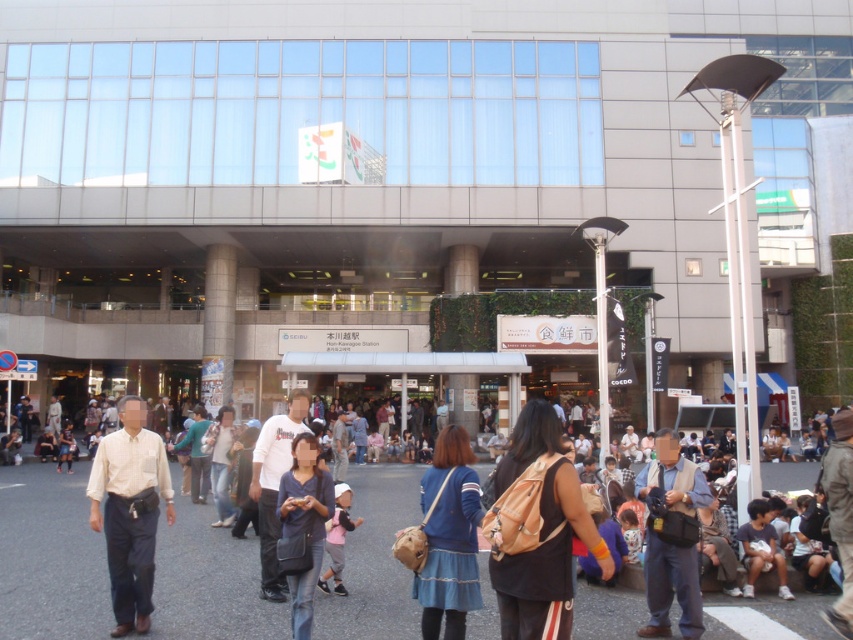
Question: Based on their relative distances, which object is nearer to the blue denim jeans at center?

Choices:
 (A) blue fabric shirt at lower right
 (B) light brown leather jacket at center

Answer: (A)

Question: Is matte gray building at center below light brown leather jacket at center?

Choices:
 (A) no
 (B) yes

Answer: (A)

Question: Is blue fabric dress at center to the right of blue denim jeans at center from the viewer's perspective?

Choices:
 (A) no
 (B) yes

Answer: (B)

Question: Which point is closer to the camera?

Choices:
 (A) light beige shirt at center
 (B) brown leather backpack at center
 (C) light brown leather jacket at center
 (D) blue fabric dress at center

Answer: (B)

Question: Which point is farther from the camera taking this photo?

Choices:
 (A) (666, 552)
 (B) (624, 76)

Answer: (B)

Question: Is light brown leather jacket at center closer to camera compared to blue fabric dress at center?

Choices:
 (A) no
 (B) yes

Answer: (A)